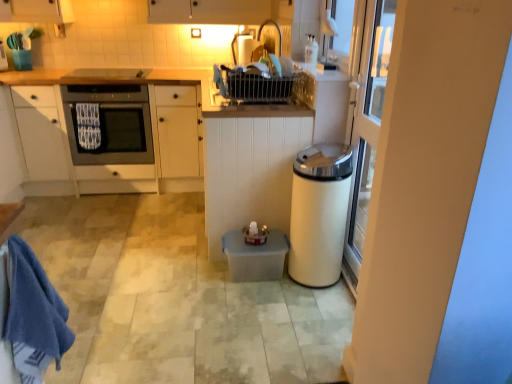
Question: Is the position of white matte cabinet at center, the 1th cabinetry viewed from the right, less distant than that of white matte cabinet at left, which is the 1th cabinetry in left-to-right order?

Choices:
 (A) yes
 (B) no

Answer: (A)

Question: From a real-world perspective, is white matte cabinet at center, the 1th cabinetry viewed from the right, on white matte cabinet at left, positioned as the 2th cabinetry in right-to-left order?

Choices:
 (A) no
 (B) yes

Answer: (A)

Question: Is white matte cabinet at center, positioned as the 2th cabinetry in left-to-right order, aimed at white matte cabinet at left, positioned as the 2th cabinetry in right-to-left order?

Choices:
 (A) yes
 (B) no

Answer: (A)

Question: Considering the relative sizes of white matte cabinet at center, positioned as the 2th cabinetry in left-to-right order, and white matte cabinet at left, which is the 1th cabinetry in left-to-right order, in the image provided, is white matte cabinet at center, positioned as the 2th cabinetry in left-to-right order, taller than white matte cabinet at left, which is the 1th cabinetry in left-to-right order,?

Choices:
 (A) yes
 (B) no

Answer: (B)

Question: From the image's perspective, is white matte cabinet at center, the 1th cabinetry viewed from the right, located beneath white matte cabinet at left, positioned as the 2th cabinetry in right-to-left order?

Choices:
 (A) yes
 (B) no

Answer: (A)

Question: From a real-world perspective, is white matte cabinet at left, which is the 1th cabinetry in left-to-right order, physically located above or below white glossy trash can at right?

Choices:
 (A) above
 (B) below

Answer: (A)

Question: In the image, is white matte cabinet at left, positioned as the 2th cabinetry in right-to-left order, on the left side or the right side of white glossy trash can at right?

Choices:
 (A) right
 (B) left

Answer: (B)

Question: In the image, is white matte cabinet at left, positioned as the 2th cabinetry in right-to-left order, positioned in front of or behind white glossy trash can at right?

Choices:
 (A) front
 (B) behind

Answer: (B)

Question: Considering the positions of white matte cabinet at left, which is the 1th cabinetry in left-to-right order, and white glossy trash can at right in the image, is white matte cabinet at left, which is the 1th cabinetry in left-to-right order, wider or thinner than white glossy trash can at right?

Choices:
 (A) thin
 (B) wide

Answer: (B)

Question: Looking at their shapes, would you say matte black oven at left is wider or thinner than white textured bath towel at left, which is counted as the 1th bath towel, starting from the top?

Choices:
 (A) wide
 (B) thin

Answer: (A)

Question: Considering the positions of matte black oven at left and white textured bath towel at left, the first bath towel positioned from the left, in the image, is matte black oven at left taller or shorter than white textured bath towel at left, the first bath towel positioned from the left,?

Choices:
 (A) tall
 (B) short

Answer: (A)

Question: Is matte black oven at left bigger or smaller than white textured bath towel at left, the first bath towel positioned from the left?

Choices:
 (A) small
 (B) big

Answer: (B)

Question: Is point (95, 115) positioned closer to the camera than point (96, 105)?

Choices:
 (A) farther
 (B) closer

Answer: (A)

Question: Is point (311, 182) positioned closer to the camera than point (31, 253)?

Choices:
 (A) closer
 (B) farther

Answer: (B)

Question: Based on their positions, is white glossy trash can at right located to the left or right of blue cotton towel at lower left, marked as the 1th bath towel in a bottom-to-top arrangement?

Choices:
 (A) right
 (B) left

Answer: (A)